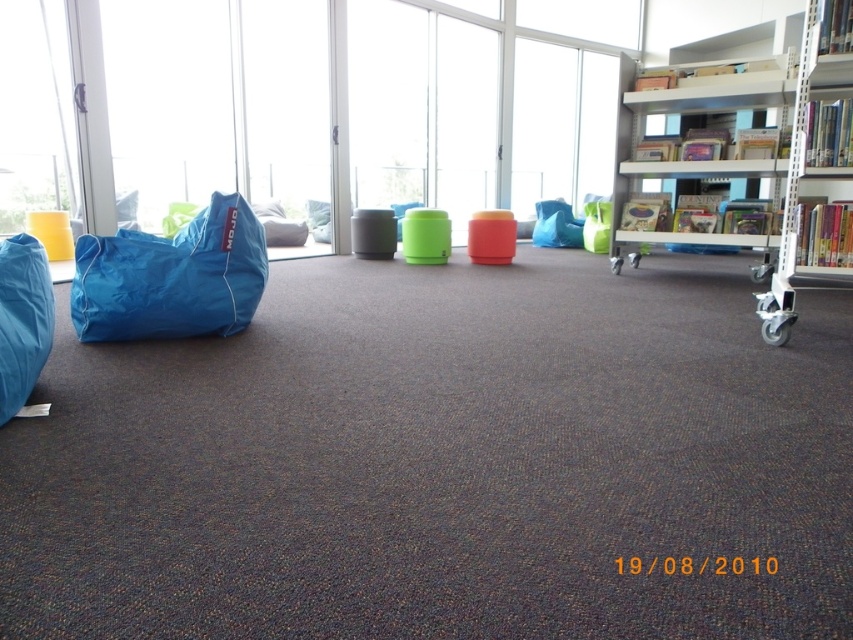
Can you confirm if blue fabric beanbag at left is shorter than white metal shelf at upper right?

Indeed, blue fabric beanbag at left has a lesser height compared to white metal shelf at upper right.

Can you confirm if blue fabric beanbag at left is positioned to the left of white metal shelf at upper right?

Correct, you'll find blue fabric beanbag at left to the left of white metal shelf at upper right.

Identify the location of blue fabric beanbag at left. The image size is (853, 640). (171, 276).

Does point (643, 106) lie in front of point (785, 192)?

No.

Identify the location of white metal shelf at upper right. The image size is (853, 640). (686, 113).

Between blue fabric beanbag at left and white plastic shelf at right, which one has more height?

white plastic shelf at right

Which is above, blue fabric beanbag at left or white plastic shelf at right?

white plastic shelf at right

The image size is (853, 640). Identify the location of blue fabric beanbag at left. (171, 276).

Find the location of a particular element. The height and width of the screenshot is (640, 853). blue fabric beanbag at left is located at coordinates (171, 276).